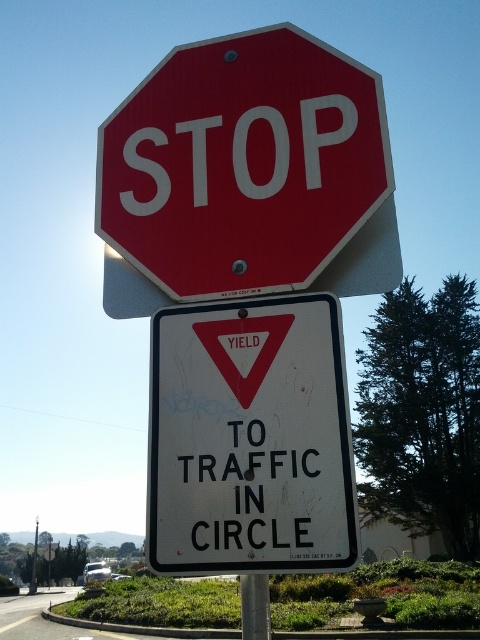
You are a delivery driver approaching an intersection with a pole holding two traffic signs. You need to know if the white matte yield sign at center is smaller than the metallic pole at center. Can you confirm this?

The white matte yield sign at center has a smaller size compared to metallic pole at center, so yes, the white matte yield sign at center is indeed smaller than the metallic pole at center.

You are a driver approaching an intersection with two traffic signs on a pole. You see the smooth red stop sign at center and the white matte yield sign at center. Which sign should you pay attention to first based on their sizes?

The smooth red stop sign at center is larger in size than the white matte yield sign at center, so you should pay attention to the smooth red stop sign at center first because it is more prominent due to its larger size.

You are a pedestrian looking at two traffic signs on a pole. You see the smooth red stop sign at center and the white matte yield sign at center. Which of these signs is positioned to the left side from your perspective?

The smooth red stop sign at center is positioned to the left of the white matte yield sign at center, so the smooth red stop sign at center is on the left side.